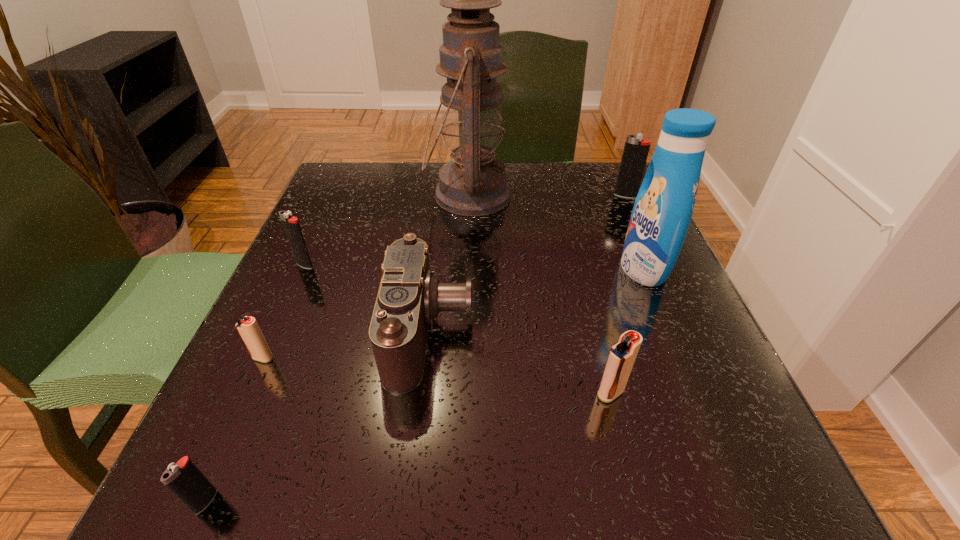
The width and height of the screenshot is (960, 540). In order to click on black igniter identified as the second closest to the nearest igniter in this screenshot , I will do `click(636, 149)`.